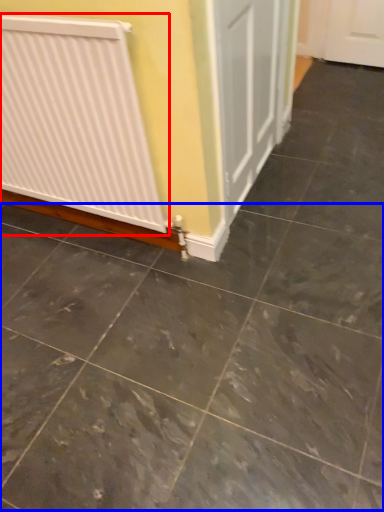
Question: Which object appears farthest to the camera in this image, radiator (highlighted by a red box) or concrete (highlighted by a blue box)?

Choices:
 (A) radiator
 (B) concrete

Answer: (A)